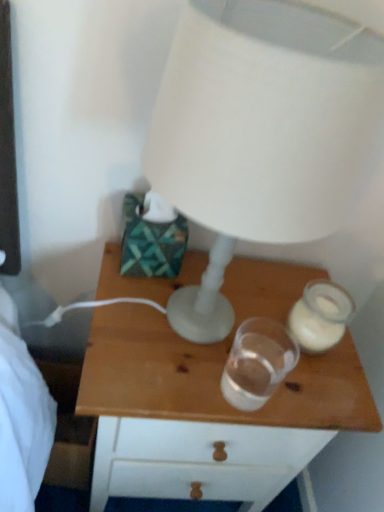
Question: From the image's perspective, is wooden nightstand at center located beneath translucent glass candle holder at right, the second candle holder viewed from the left?

Choices:
 (A) no
 (B) yes

Answer: (B)

Question: From a real-world perspective, is wooden nightstand at center over translucent glass candle holder at right, the second candle holder viewed from the left?

Choices:
 (A) no
 (B) yes

Answer: (A)

Question: Is wooden nightstand at center wider than translucent glass candle holder at right, the second candle holder viewed from the left?

Choices:
 (A) yes
 (B) no

Answer: (A)

Question: Does wooden nightstand at center have a lesser height compared to translucent glass candle holder at right, the second candle holder viewed from the left?

Choices:
 (A) no
 (B) yes

Answer: (A)

Question: Considering the relative positions of wooden nightstand at center and translucent glass candle holder at right, the first candle holder in the right-to-left sequence, in the image provided, is wooden nightstand at center in front of translucent glass candle holder at right, the first candle holder in the right-to-left sequence,?

Choices:
 (A) no
 (B) yes

Answer: (B)

Question: In the image, is wooden nightstand at center positioned in front of or behind translucent glass candle holder at right, the first candle holder in the right-to-left sequence?

Choices:
 (A) front
 (B) behind

Answer: (A)

Question: Is wooden nightstand at center taller or shorter than translucent glass candle holder at right, the first candle holder in the right-to-left sequence?

Choices:
 (A) short
 (B) tall

Answer: (B)

Question: Looking at their shapes, would you say wooden nightstand at center is wider or thinner than translucent glass candle holder at right, the second candle holder viewed from the left?

Choices:
 (A) wide
 (B) thin

Answer: (A)

Question: From a real-world perspective, relative to translucent glass candle holder at right, the second candle holder viewed from the left, is wooden nightstand at center vertically above or below?

Choices:
 (A) above
 (B) below

Answer: (B)

Question: Based on their sizes in the image, would you say transparent glass at center, the first candle holder positioned from the left, is bigger or smaller than wooden nightstand at center?

Choices:
 (A) big
 (B) small

Answer: (B)

Question: Is transparent glass at center, the first candle holder positioned from the left, situated inside wooden nightstand at center or outside?

Choices:
 (A) outside
 (B) inside

Answer: (A)

Question: In the image, is transparent glass at center, the first candle holder positioned from the left, on the left side or the right side of wooden nightstand at center?

Choices:
 (A) left
 (B) right

Answer: (B)

Question: Relative to wooden nightstand at center, is transparent glass at center, the first candle holder positioned from the left, in front or behind?

Choices:
 (A) front
 (B) behind

Answer: (A)

Question: Would you say translucent glass candle holder at right, the second candle holder viewed from the left, is to the left or to the right of transparent glass at center, the first candle holder positioned from the left, in the picture?

Choices:
 (A) right
 (B) left

Answer: (A)

Question: From the image's perspective, is translucent glass candle holder at right, the second candle holder viewed from the left, located above or below transparent glass at center, the first candle holder positioned from the left?

Choices:
 (A) above
 (B) below

Answer: (A)